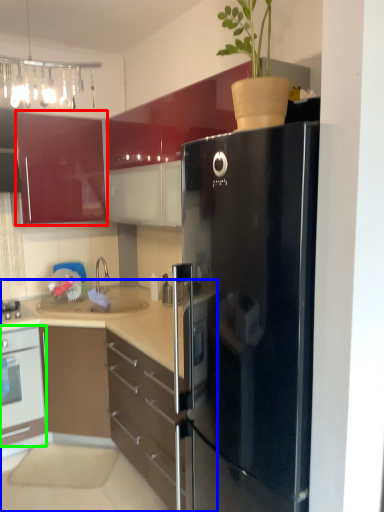
Question: Which object is the farthest from cabinetry (highlighted by a red box)? Choose among these: cabinetry (highlighted by a blue box) or oven (highlighted by a green box).

Choices:
 (A) cabinetry
 (B) oven

Answer: (A)